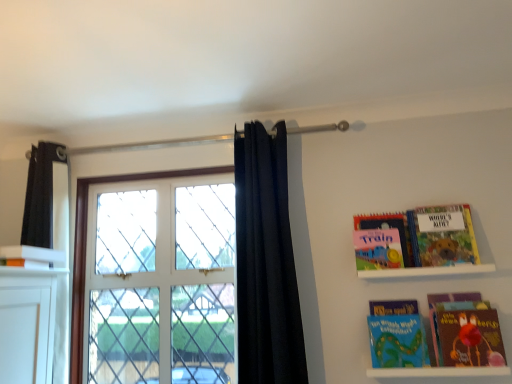
Question: Is white matte shelf at lower right, marked as the 1th shelf in a bottom-to-top arrangement, aimed at white glossy book at upper left, which appears as the 1th book when viewed from the left?

Choices:
 (A) yes
 (B) no

Answer: (B)

Question: Can we say white matte shelf at lower right, the 2th shelf in the top-to-bottom sequence, lies outside white glossy book at upper left, which appears as the 1th book when viewed from the left?

Choices:
 (A) no
 (B) yes

Answer: (B)

Question: Does white matte shelf at lower right, the 2th shelf in the top-to-bottom sequence, have a greater width compared to white glossy book at upper left, which appears as the 1th book when viewed from the left?

Choices:
 (A) no
 (B) yes

Answer: (A)

Question: Is white matte shelf at lower right, marked as the 1th shelf in a bottom-to-top arrangement, bigger than white glossy book at upper left, which appears as the 1th book when viewed from the left?

Choices:
 (A) no
 (B) yes

Answer: (B)

Question: From a real-world perspective, is white matte shelf at lower right, marked as the 1th shelf in a bottom-to-top arrangement, positioned over white glossy book at upper left, which appears as the 1th book when viewed from the left, based on gravity?

Choices:
 (A) yes
 (B) no

Answer: (B)

Question: Is white matte shelf at lower right, the 2th shelf in the top-to-bottom sequence, positioned with its back to white glossy book at upper left, which appears as the 1th book when viewed from the left?

Choices:
 (A) no
 (B) yes

Answer: (A)

Question: Is the position of hardcover book at upper right, which appears as the 4th book when viewed from the left, less distant than that of matte red book at lower right?

Choices:
 (A) no
 (B) yes

Answer: (A)

Question: From a real-world perspective, is hardcover book at upper right, which appears as the 4th book when viewed from the left, beneath matte red book at lower right?

Choices:
 (A) no
 (B) yes

Answer: (A)

Question: Does hardcover book at upper right, which appears as the 4th book when viewed from the left, have a larger size compared to matte red book at lower right?

Choices:
 (A) yes
 (B) no

Answer: (B)

Question: Could you tell me if hardcover book at upper right, which appears as the 4th book when viewed from the left, is facing matte red book at lower right?

Choices:
 (A) yes
 (B) no

Answer: (B)

Question: Is hardcover book at upper right, which is the 1th book from right to left, with matte red book at lower right?

Choices:
 (A) no
 (B) yes

Answer: (A)

Question: From the image's perspective, is white glass window at center located above matte pink book at upper right, placed as the 2th book when sorted from left to right?

Choices:
 (A) yes
 (B) no

Answer: (B)